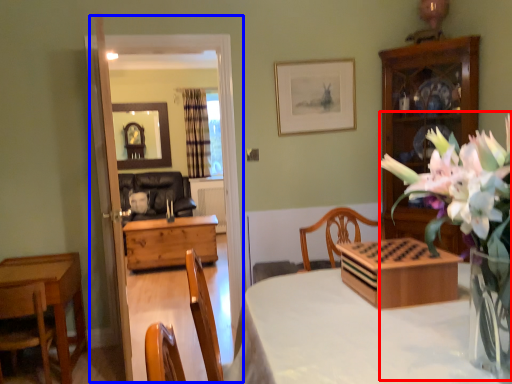
Question: Which object is further to the camera taking this photo, floral arrangement (highlighted by a red box) or glass door (highlighted by a blue box)?

Choices:
 (A) floral arrangement
 (B) glass door

Answer: (B)